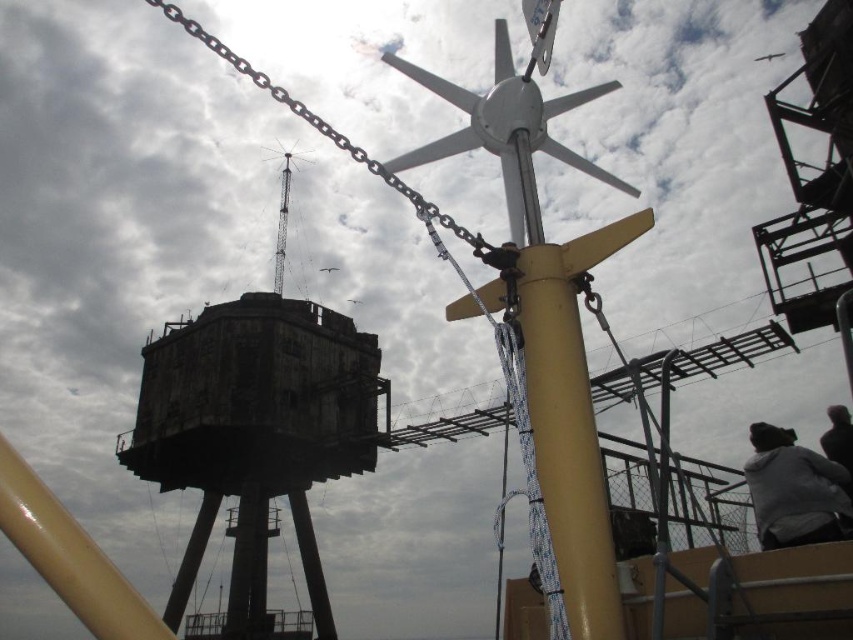
Question: Is dark gray concrete tower at center thinner than dark gray hair at lower right?

Choices:
 (A) no
 (B) yes

Answer: (A)

Question: Which object appears farthest from the camera in this image?

Choices:
 (A) dark gray concrete tower at center
 (B) gray fleece jacket at lower right
 (C) dark gray hair at lower right

Answer: (A)

Question: Which object is closer to the camera taking this photo?

Choices:
 (A) dark gray hair at lower right
 (B) dark gray concrete tower at center

Answer: (A)

Question: Considering the real-world distances, which object is farthest from the dark gray concrete tower at center?

Choices:
 (A) gray fleece jacket at lower right
 (B) dark gray hair at lower right

Answer: (A)

Question: Does dark gray concrete tower at center come behind dark gray hair at lower right?

Choices:
 (A) yes
 (B) no

Answer: (A)

Question: Can you confirm if dark gray concrete tower at center is smaller than gray fleece jacket at lower right?

Choices:
 (A) no
 (B) yes

Answer: (A)